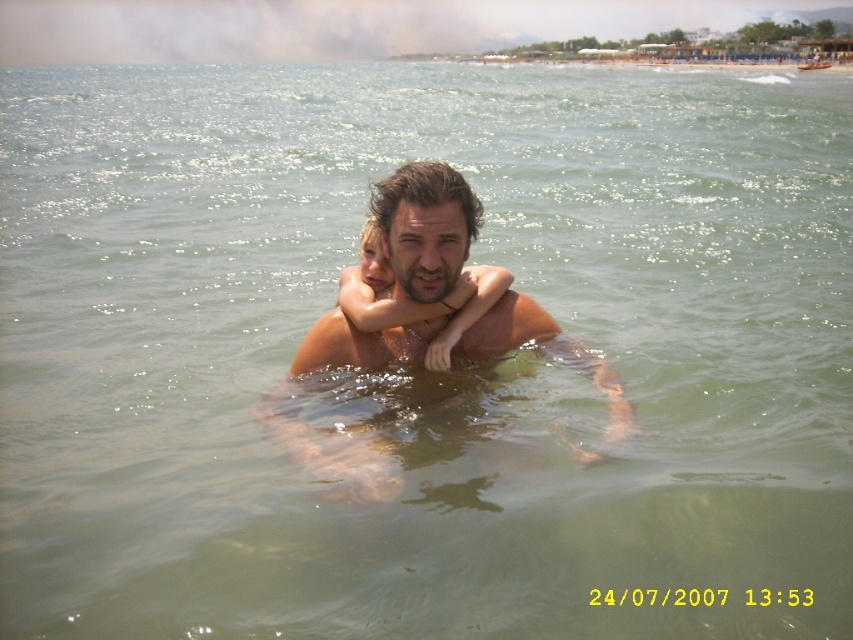
You are a photographer standing at the origin point of the image coordinate system. You want to take a photo of the smooth skin man at center. What are the coordinates where you should aim your camera?

The coordinates where you should aim your camera are at point [422,230].

You are a photographer taking a picture of the smooth skin man at center and the smooth skin child at center. Which one will appear taller in the photo?

The smooth skin man at center is taller than the smooth skin child at center, so he will appear taller in the photo.